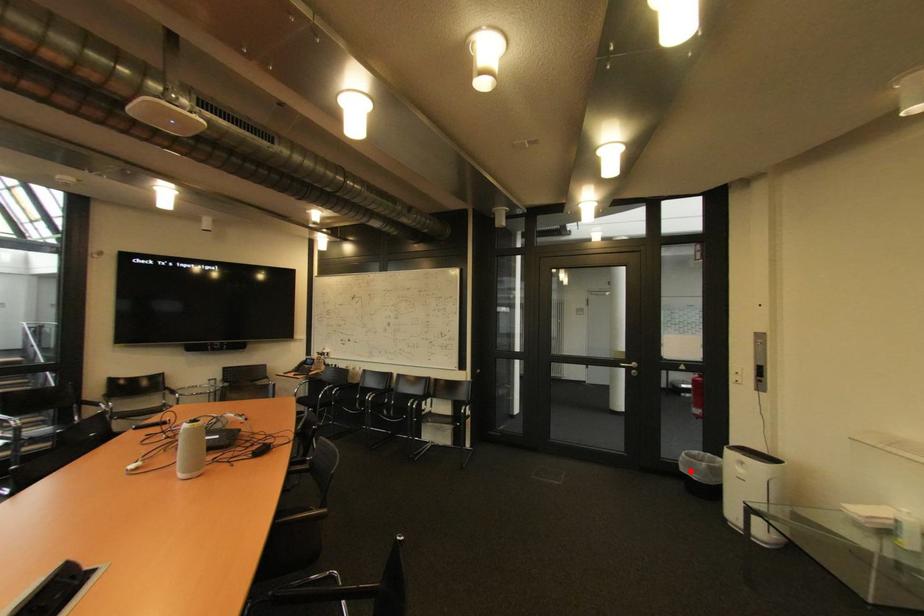
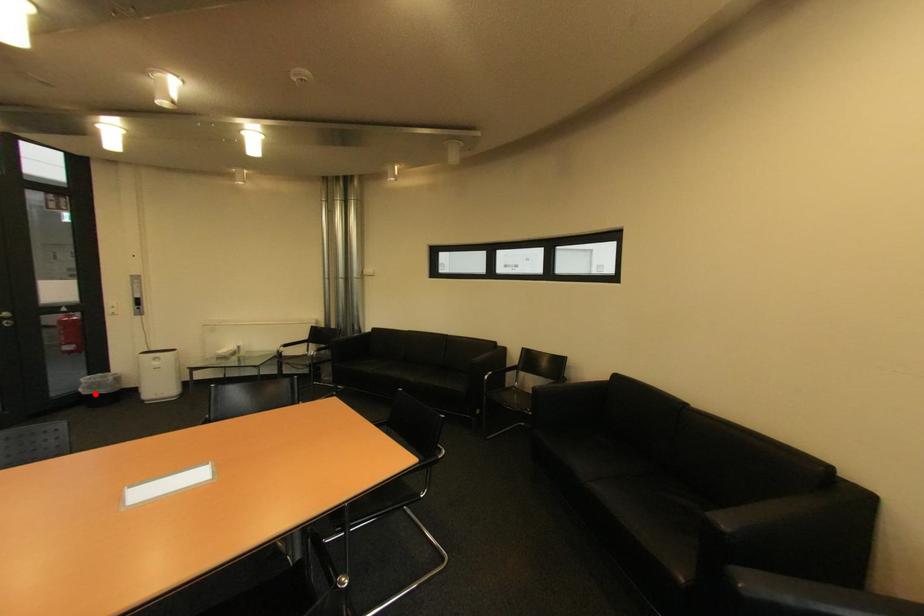
I am providing you with two images of the same scene from different viewpoints. A red point is marked on the first image and another point is marked on the second image. Do the highlighted points in image1 and image2 indicate the same real-world spot?

Yes